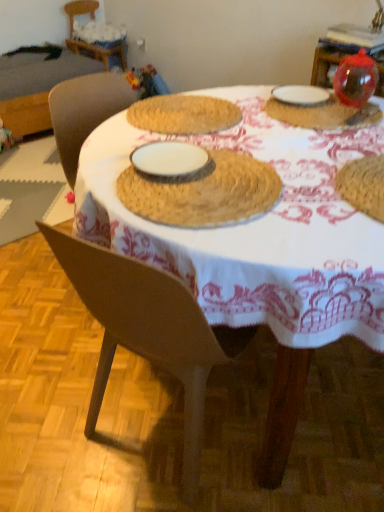
How much space does woven straw placemat at upper left, arranged as the first table when viewed from the left, occupy horizontally?

The width of woven straw placemat at upper left, arranged as the first table when viewed from the left, is 33.89 inches.

The image size is (384, 512). What do you see at coordinates (355, 79) in the screenshot?
I see `transparent plastic ornament at upper right, the third tableware from the left` at bounding box center [355, 79].

What is the approximate width of woven straw placemat at center, which is counted as the 2th table, starting from the back?

woven straw placemat at center, which is counted as the 2th table, starting from the back, is 1.21 meters in width.

Describe the element at coordinates (88, 42) in the screenshot. I see `wooden chair at upper left` at that location.

Where is `woven straw placemat at upper left, arranged as the first table when viewed from the left`? Image resolution: width=384 pixels, height=512 pixels. woven straw placemat at upper left, arranged as the first table when viewed from the left is located at coordinates (35, 88).

Between woven straw placemat at upper left, arranged as the 2th table when viewed from the front, and white ceramic plate at upper right, marked as the 3th tableware in a right-to-left arrangement, which one has larger size?

Bigger between the two is woven straw placemat at upper left, arranged as the 2th table when viewed from the front.

Is woven straw placemat at upper left, acting as the 1th table starting from the back, looking in the opposite direction of white ceramic plate at upper right, marked as the 3th tableware in a right-to-left arrangement?

No, woven straw placemat at upper left, acting as the 1th table starting from the back, is not facing the opposite direction of white ceramic plate at upper right, marked as the 3th tableware in a right-to-left arrangement.

Are woven straw placemat at upper left, acting as the 1th table starting from the back, and white ceramic plate at upper right, the first tableware viewed from the left, far apart?

Yes.

Is woven straw placemat at upper left, acting as the 2th table starting from the bottom, wider or thinner than white ceramic plate at upper right, the first tableware viewed from the left?

Considering their sizes, woven straw placemat at upper left, acting as the 2th table starting from the bottom, looks broader than white ceramic plate at upper right, the first tableware viewed from the left.

From a real-world perspective, is transparent plastic ornament at upper right, the third tableware from the left, above or below wooden chair at upper left?

In terms of real-world spatial position, transparent plastic ornament at upper right, the third tableware from the left, is above wooden chair at upper left.

Consider the image. Are transparent plastic ornament at upper right, the 1th tableware viewed from the right, and wooden chair at upper left beside each other?

There is a gap between transparent plastic ornament at upper right, the 1th tableware viewed from the right, and wooden chair at upper left.

How different are the orientations of transparent plastic ornament at upper right, the 1th tableware viewed from the right, and wooden chair at upper left in degrees?

transparent plastic ornament at upper right, the 1th tableware viewed from the right, and wooden chair at upper left are facing 179 degrees away from each other.

Between transparent plastic ornament at upper right, the 1th tableware viewed from the right, and wooden chair at upper left, which one has smaller size?

With smaller size is transparent plastic ornament at upper right, the 1th tableware viewed from the right.

Could you tell me if white ceramic plate at upper right, the first tableware viewed from the left, is turned towards woven straw placemat at upper left, which is counted as the 2th table, starting from the right?

No, white ceramic plate at upper right, the first tableware viewed from the left, is not facing towards woven straw placemat at upper left, which is counted as the 2th table, starting from the right.

Between white ceramic plate at upper right, marked as the 3th tableware in a right-to-left arrangement, and woven straw placemat at upper left, acting as the 1th table starting from the back, which one has smaller width?

white ceramic plate at upper right, marked as the 3th tableware in a right-to-left arrangement, is thinner.

Considering the sizes of white ceramic plate at upper right, marked as the 3th tableware in a right-to-left arrangement, and woven straw placemat at upper left, which is counted as the 2th table, starting from the right, in the image, is white ceramic plate at upper right, marked as the 3th tableware in a right-to-left arrangement, taller or shorter than woven straw placemat at upper left, which is counted as the 2th table, starting from the right,?

In the image, white ceramic plate at upper right, marked as the 3th tableware in a right-to-left arrangement, appears to be shorter than woven straw placemat at upper left, which is counted as the 2th table, starting from the right.

This screenshot has width=384, height=512. In order to click on the 2nd tableware below when counting from the woven straw placemat at upper left, arranged as the first table when viewed from the left (from the image's perspective) in this screenshot , I will do `click(301, 95)`.

Is there a large distance between transparent plastic ornament at upper right, the third tableware from the left, and woven straw placemat at center, which appears as the second table when viewed from the top?

No, transparent plastic ornament at upper right, the third tableware from the left, is not far from woven straw placemat at center, which appears as the second table when viewed from the top.

How different are the orientations of transparent plastic ornament at upper right, the third tableware from the left, and woven straw placemat at center, which appears as the second table when viewed from the top, in degrees?

transparent plastic ornament at upper right, the third tableware from the left, and woven straw placemat at center, which appears as the second table when viewed from the top, are facing 5.28 degrees away from each other.

Is transparent plastic ornament at upper right, the third tableware from the left, located outside woven straw placemat at center, arranged as the first table when viewed from the right?

Indeed, transparent plastic ornament at upper right, the third tableware from the left, is completely outside woven straw placemat at center, arranged as the first table when viewed from the right.

Is point (363, 74) closer to viewer compared to point (106, 197)?

That is False.

Considering the sizes of objects woven straw placemat at upper left, arranged as the 2th table when viewed from the front, and transparent plastic ornament at upper right, the 1th tableware viewed from the right, in the image provided, who is smaller, woven straw placemat at upper left, arranged as the 2th table when viewed from the front, or transparent plastic ornament at upper right, the 1th tableware viewed from the right,?

With smaller size is transparent plastic ornament at upper right, the 1th tableware viewed from the right.

Considering the sizes of objects woven straw placemat at upper left, the 1th table positioned from the top, and transparent plastic ornament at upper right, the 1th tableware viewed from the right, in the image provided, who is thinner, woven straw placemat at upper left, the 1th table positioned from the top, or transparent plastic ornament at upper right, the 1th tableware viewed from the right,?

Thinner between the two is transparent plastic ornament at upper right, the 1th tableware viewed from the right.

Is woven straw placemat at upper left, acting as the 2th table starting from the bottom, next to transparent plastic ornament at upper right, the third tableware from the left?

No, woven straw placemat at upper left, acting as the 2th table starting from the bottom, is not beside transparent plastic ornament at upper right, the third tableware from the left.

Find the location of a particular element. The image size is (384, 512). the 2nd tableware in front of the woven straw placemat at upper left, the 1th table positioned from the top is located at coordinates (355, 79).

Is wooden chair at upper left bigger than transparent plastic ornament at upper right, the 1th tableware viewed from the right?

Yes, wooden chair at upper left is bigger than transparent plastic ornament at upper right, the 1th tableware viewed from the right.

Is transparent plastic ornament at upper right, the third tableware from the left, inside wooden chair at upper left?

Definitely not — transparent plastic ornament at upper right, the third tableware from the left, is not inside wooden chair at upper left.

From the picture: Between wooden chair at upper left and transparent plastic ornament at upper right, the third tableware from the left, which one has less height?

transparent plastic ornament at upper right, the third tableware from the left.

Is transparent plastic ornament at upper right, the third tableware from the left, at the back of wooden chair at upper left?

No, transparent plastic ornament at upper right, the third tableware from the left, is not at the back of wooden chair at upper left.

Considering the relative sizes of wooden chair at upper left and woven straw placemat at upper left, the 1th table positioned from the top, in the image provided, is wooden chair at upper left shorter than woven straw placemat at upper left, the 1th table positioned from the top,?

No, wooden chair at upper left is not shorter than woven straw placemat at upper left, the 1th table positioned from the top.

From the image's perspective, which is below, wooden chair at upper left or woven straw placemat at upper left, the 1th table positioned from the top?

woven straw placemat at upper left, the 1th table positioned from the top, appears lower in the image.

Is wooden chair at upper left to the right of woven straw placemat at upper left, which is counted as the 2th table, starting from the right, from the viewer's perspective?

Indeed, wooden chair at upper left is positioned on the right side of woven straw placemat at upper left, which is counted as the 2th table, starting from the right.

Is woven straw placemat at upper left, acting as the 1th table starting from the back, a part of wooden chair at upper left?

No, woven straw placemat at upper left, acting as the 1th table starting from the back, is not a part of wooden chair at upper left.

At what (x,y) coordinates should I click in order to perform the action: click on the 1st tableware in front of the woven straw placemat at upper left, the 1th table positioned from the top, starting your count from the anchor. Please return your answer as a coordinate pair (x, y). The image size is (384, 512). Looking at the image, I should click on (301, 95).

This screenshot has height=512, width=384. Identify the location of the 1st tableware below the wooden chair at upper left (from the image's perspective). (355, 79).

Looking at the image, which one is located further to wooden chair at upper left, transparent plastic ball at upper right, the 2th tableware in the right-to-left sequence, or transparent plastic ornament at upper right, the 1th tableware viewed from the right?

Based on the image, transparent plastic ornament at upper right, the 1th tableware viewed from the right, appears to be further to wooden chair at upper left.

Based on the photo, which object lies nearer to the anchor point wooden chair at upper left, transparent plastic ornament at upper right, the 1th tableware viewed from the right, or woven straw placemat at center, which appears as the second table when viewed from the top?

transparent plastic ornament at upper right, the 1th tableware viewed from the right.

Based on their spatial positions, is transparent plastic ornament at upper right, the 1th tableware viewed from the right, or white ceramic plate at upper right, the first tableware viewed from the left, further from transparent plastic ball at upper right, the 2th tableware in the right-to-left sequence?

transparent plastic ornament at upper right, the 1th tableware viewed from the right, is further to transparent plastic ball at upper right, the 2th tableware in the right-to-left sequence.

From the picture: Based on their spatial positions, is woven straw placemat at center, which is counted as the 2th table, starting from the back, or woven straw placemat at upper left, arranged as the first table when viewed from the left, further from white ceramic plate at upper right, marked as the 3th tableware in a right-to-left arrangement?

Based on the image, woven straw placemat at upper left, arranged as the first table when viewed from the left, appears to be further to white ceramic plate at upper right, marked as the 3th tableware in a right-to-left arrangement.

Which object lies nearer to the anchor point white ceramic plate at upper right, the first tableware viewed from the left, woven straw placemat at center, positioned as the 1th table in front-to-back order, or transparent plastic ball at upper right, the 2th tableware in the right-to-left sequence?

Based on the image, transparent plastic ball at upper right, the 2th tableware in the right-to-left sequence, appears to be nearer to white ceramic plate at upper right, the first tableware viewed from the left.

Which object lies nearer to the anchor point transparent plastic ornament at upper right, the 1th tableware viewed from the right, woven straw placemat at upper left, arranged as the 2th table when viewed from the front, or white ceramic plate at upper right, the first tableware viewed from the left?

Based on the image, white ceramic plate at upper right, the first tableware viewed from the left, appears to be nearer to transparent plastic ornament at upper right, the 1th tableware viewed from the right.

Which object lies further to the anchor point woven straw placemat at upper left, the 1th table positioned from the top, transparent plastic ball at upper right, the 2th tableware in the right-to-left sequence, or wooden chair at upper left?

Based on the image, transparent plastic ball at upper right, the 2th tableware in the right-to-left sequence, appears to be further to woven straw placemat at upper left, the 1th table positioned from the top.

Based on their spatial positions, is transparent plastic ornament at upper right, the 1th tableware viewed from the right, or woven straw placemat at center, which appears as the second table when viewed from the top, closer to transparent plastic ball at upper right, the second tableware in the left-to-right sequence?

The object closer to transparent plastic ball at upper right, the second tableware in the left-to-right sequence, is transparent plastic ornament at upper right, the 1th tableware viewed from the right.

Where is `table located between woven straw placemat at center, arranged as the first table when viewed from the right, and wooden chair at upper left in the depth direction`? The width and height of the screenshot is (384, 512). table located between woven straw placemat at center, arranged as the first table when viewed from the right, and wooden chair at upper left in the depth direction is located at coordinates (35, 88).

Where is `tableware between transparent plastic ball at upper right, the 2th tableware in the right-to-left sequence, and white ceramic plate at upper right, marked as the 3th tableware in a right-to-left arrangement, along the z-axis`? tableware between transparent plastic ball at upper right, the 2th tableware in the right-to-left sequence, and white ceramic plate at upper right, marked as the 3th tableware in a right-to-left arrangement, along the z-axis is located at coordinates (355, 79).

The width and height of the screenshot is (384, 512). In order to click on table located between white ceramic plate at upper right, marked as the 3th tableware in a right-to-left arrangement, and wooden chair at upper left in the depth direction in this screenshot , I will do `click(35, 88)`.

Identify the location of table between transparent plastic ornament at upper right, the 1th tableware viewed from the right, and wooden chair at upper left, along the z-axis. The image size is (384, 512). (35, 88).